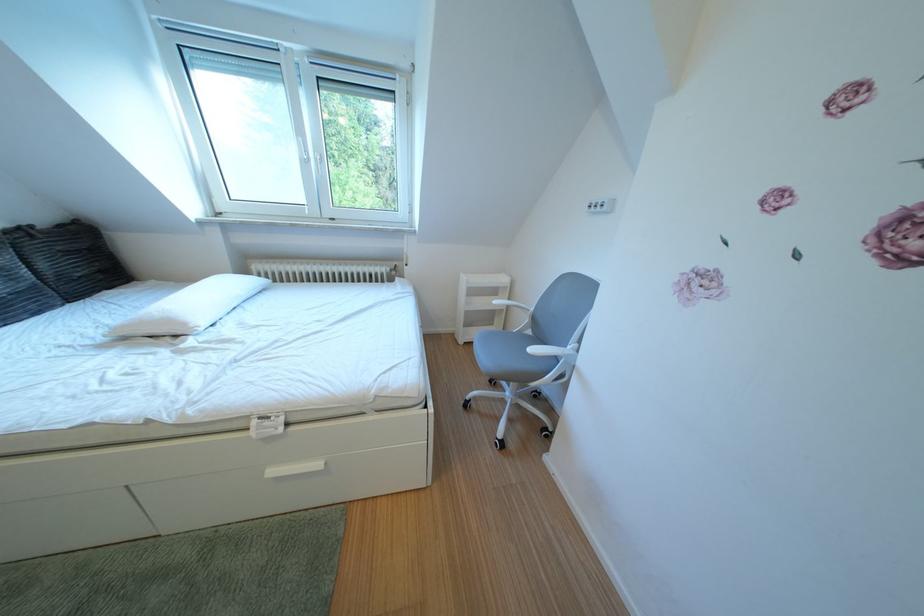
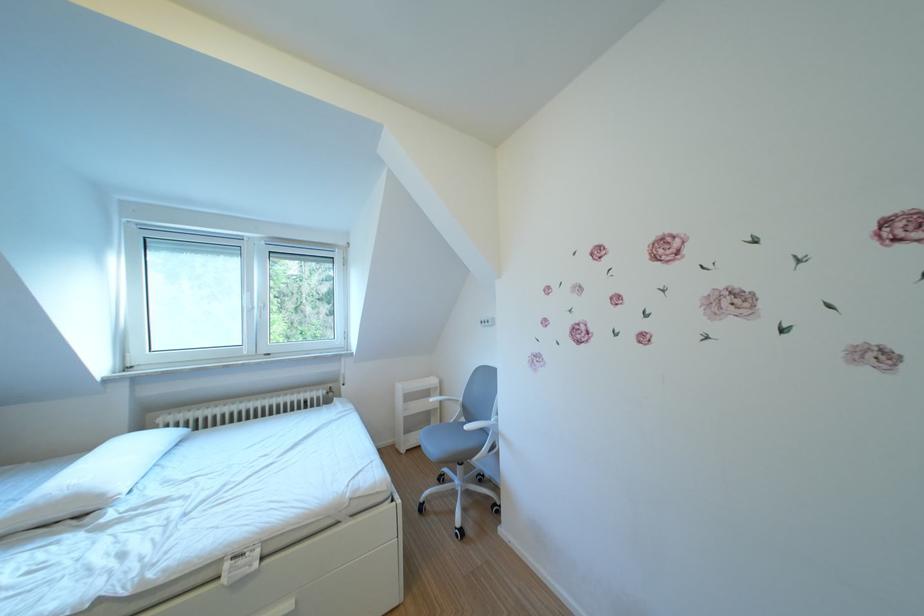
The point at (542, 337) is marked in the first image. Where is the corresponding point in the second image?

(477, 424)